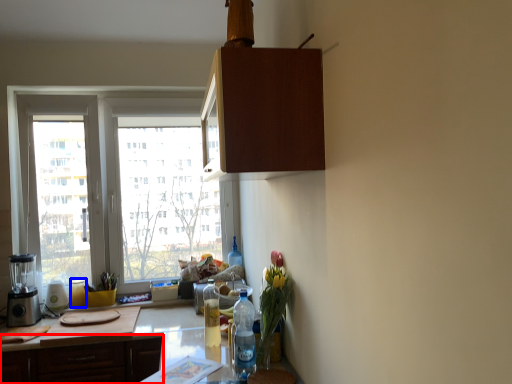
Question: Which object appears farthest to the camera in this image, cabinetry (highlighted by a red box) or bottle (highlighted by a blue box)?

Choices:
 (A) cabinetry
 (B) bottle

Answer: (B)